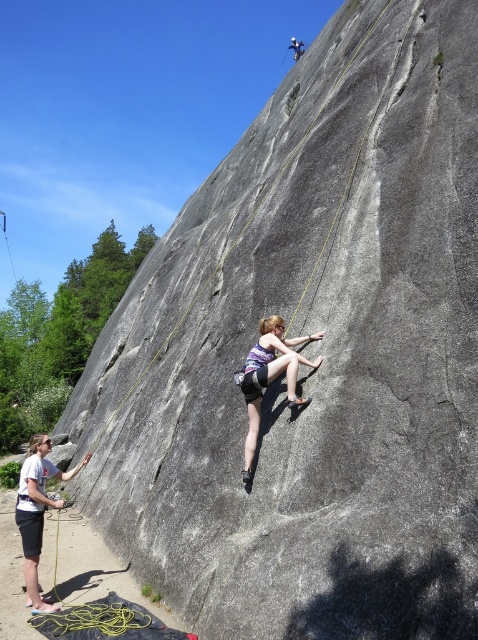
Is matte purple tank top at center closer to camera compared to matte gray rock climber at center?

Yes.

Who is more distant from viewer, (293, 352) or (293, 42)?

Point (293, 42)

Find the location of `matte purple tank top at center`. matte purple tank top at center is located at coordinates click(x=270, y=376).

Who is shorter, white cotton shirt at lower left or matte gray rock climber at center?

white cotton shirt at lower left

Consider the image. Is white cotton shirt at lower left smaller than matte gray rock climber at center?

Correct, white cotton shirt at lower left occupies less space than matte gray rock climber at center.

Does point (69, 472) come farther from viewer compared to point (292, 42)?

No.

You are a GUI agent. You are given a task and a screenshot of the screen. Output one action in this format:
    pyautogui.click(x=<x>, y=<y>)
    Task: Click on the white cotton shirt at lower left
    Image resolution: width=478 pixels, height=640 pixels.
    Given the screenshot: What is the action you would take?
    pyautogui.click(x=37, y=512)

Who is positioned more to the right, matte purple tank top at center or white cotton shirt at lower left?

matte purple tank top at center is more to the right.

Does point (247, 472) lie behind point (36, 497)?

That is False.

Locate an element on the screen. matte purple tank top at center is located at coordinates (270, 376).